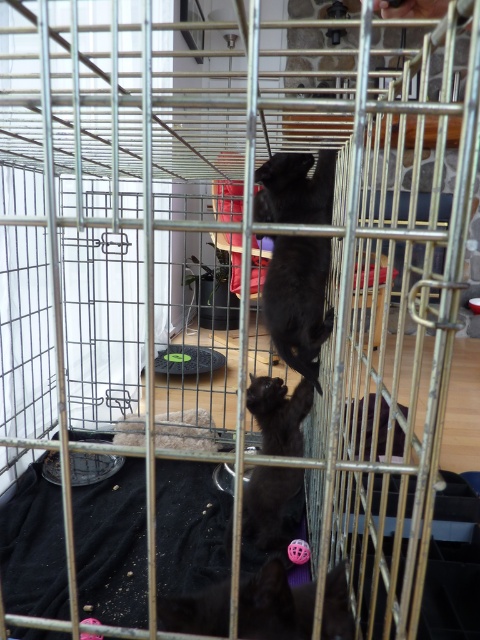
Looking at this image, you are a cat breeder observing two cats inside a metal cage. You notice the black matte fur cat at center and the black matte cat at center. Which of these cats is narrower in width?

The black matte fur cat at center has a lesser width compared to the black matte cat at center, so it is narrower.

You are holding a 1.5 meter long fishing rod and want to take it out of the cage without bending it. The cage has a metal frame with vertical bars and a horizontal top rail. You are standing inside the cage at the point labeled point (x=327, y=314). Can you safely exit the cage with the fishing rod without bending it?

The point (x=327, y=314) is 1.48 meters from the camera. Since the fishing rod is 1.5 meters long, it is slightly longer than the distance from the point to the camera. Therefore, you may not be able to exit the cage safely without bending the fishing rod.

You are a cat owner who wants to ensure both kittens are visible through the cage bars. Which kitten, the black matte fur cat at center or the black matte cat at center, is easier to see from outside the cage?

The black matte fur cat at center is positioned on the right side of black matte cat at center, so the black matte fur cat at center is easier to see from outside the cage because it is closer to the bars facing the viewer.